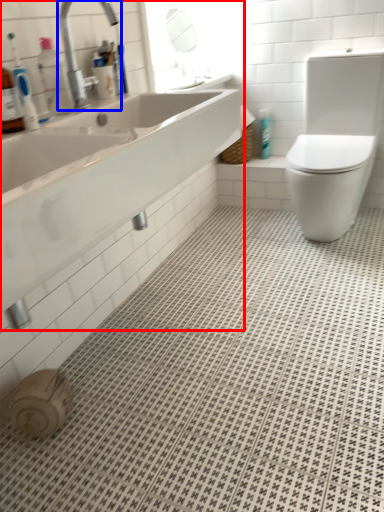
Question: Which object is closer to the camera taking this photo, sink (highlighted by a red box) or tap (highlighted by a blue box)?

Choices:
 (A) sink
 (B) tap

Answer: (A)